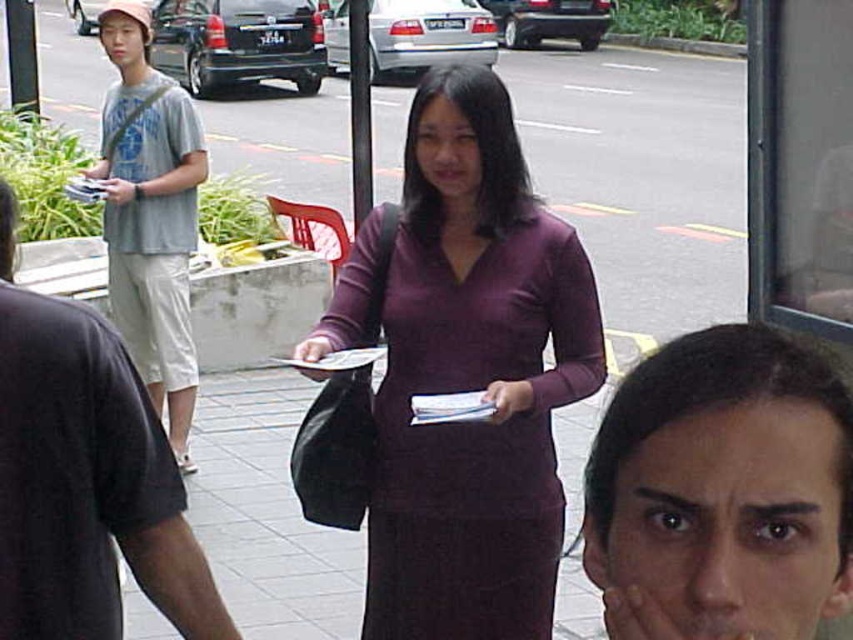
Does denim shorts at left come behind light gray cotton t-shirt at left?

No, it is in front of light gray cotton t-shirt at left.

Is denim shorts at left taller than light gray cotton t-shirt at left?

No.

Identify the location of denim shorts at left. (85, 477).

Can you confirm if smooth skin face at center is wider than denim shorts at left?

Incorrect, smooth skin face at center's width does not surpass denim shorts at left's.

Does smooth skin face at center have a lesser height compared to denim shorts at left?

Correct, smooth skin face at center is not as tall as denim shorts at left.

The width and height of the screenshot is (853, 640). Identify the location of smooth skin face at center. (723, 490).

Does purple matte dress at center have a lesser width compared to smooth skin face at center?

No.

Which is behind, point (444, 595) or point (762, 467)?

The point (444, 595) is more distant.

Find the location of a particular element. The height and width of the screenshot is (640, 853). purple matte dress at center is located at coordinates (474, 378).